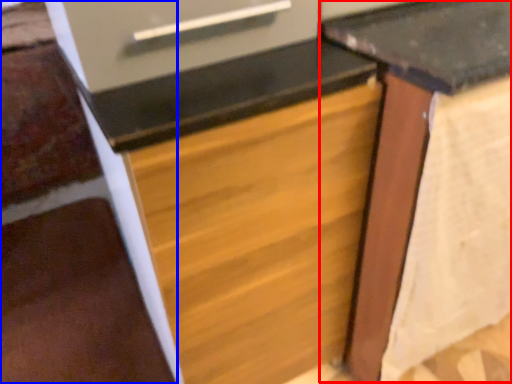
Question: Which point is further to the camera, table (highlighted by a red box) or stairwell (highlighted by a blue box)?

Choices:
 (A) table
 (B) stairwell

Answer: (B)